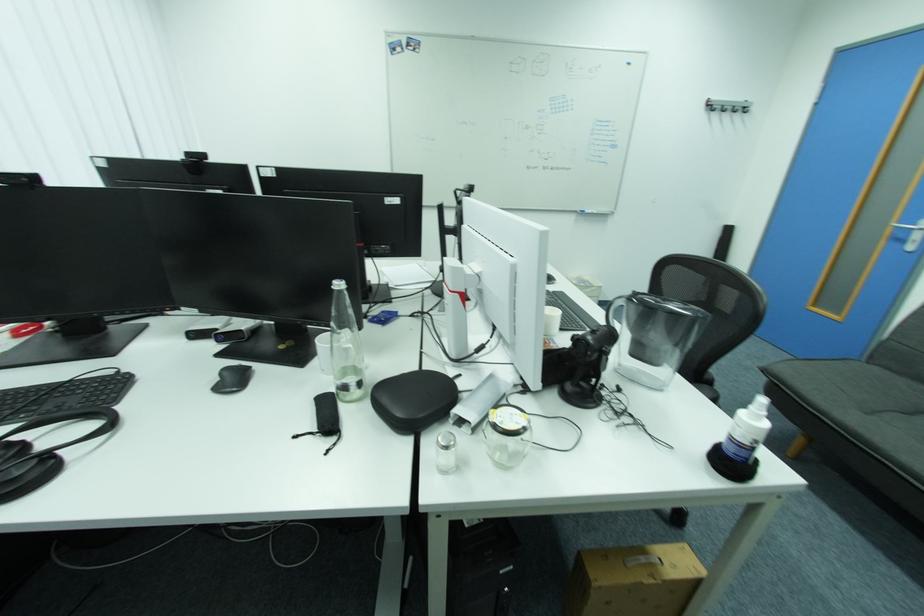
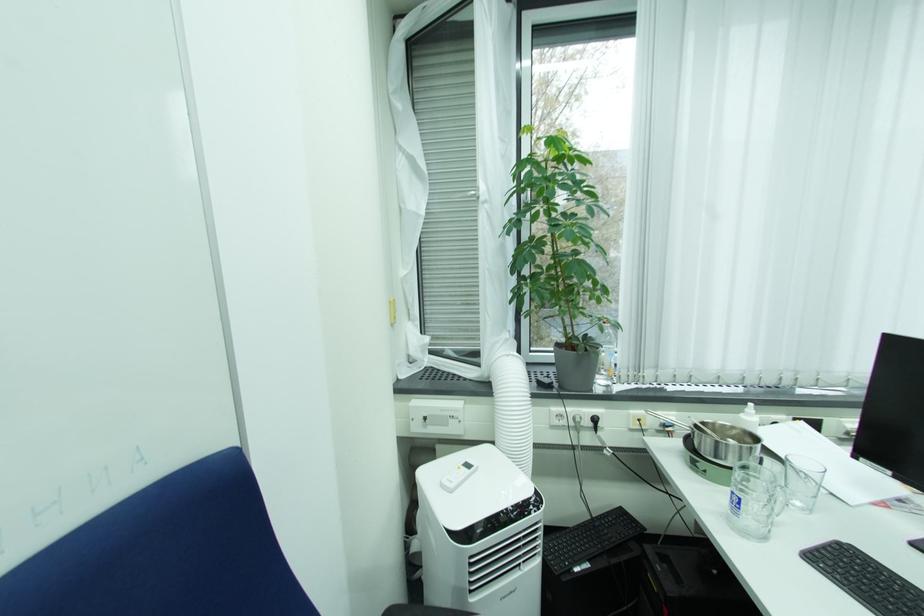
Question: The first image is from the beginning of the video and the second image is from the end. How did the camera likely rotate when shooting the video?

Choices:
 (A) Left
 (B) Right
 (C) Up
 (D) Down

Answer: (A)